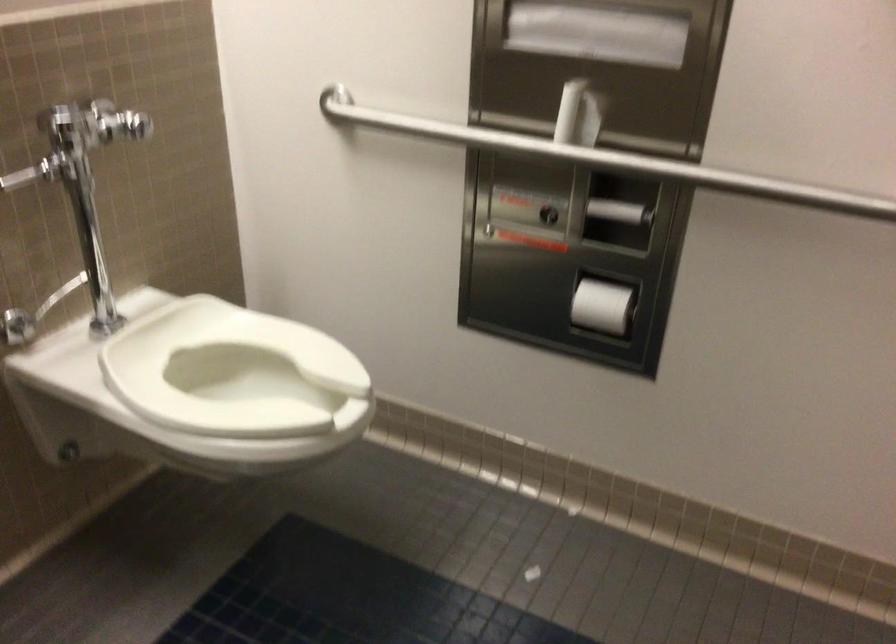
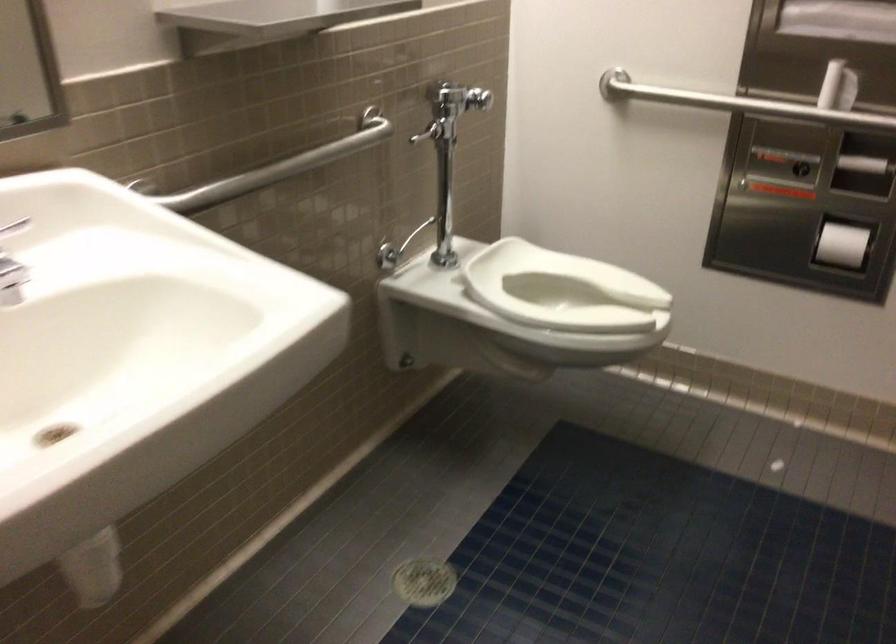
Find the pixel in the second image that matches (274,362) in the first image.

(563, 290)